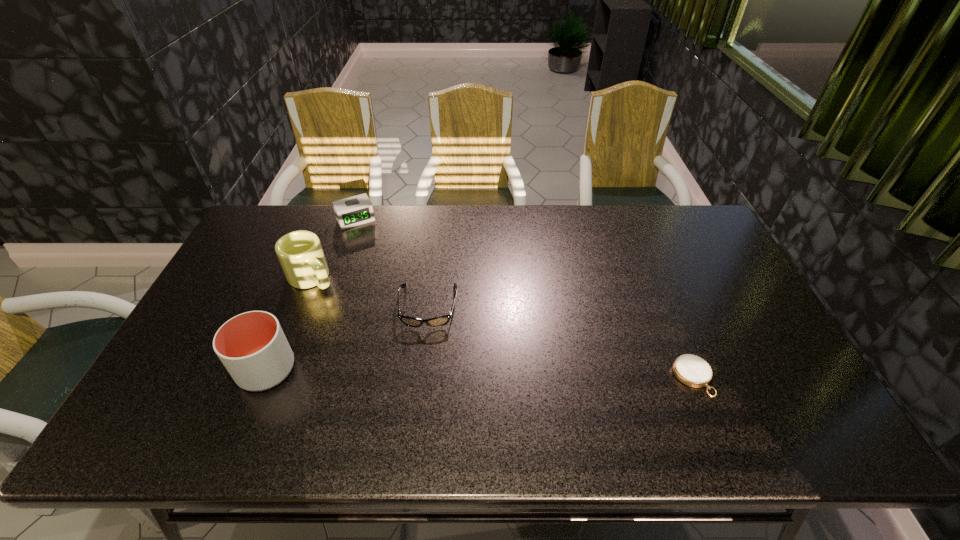
Identify the location of free location that satisfies the following two spatial constraints: 1. on the front side of the compass; 2. on the right side of the alarm clock. (303, 377).

Locate an element on the screen. The image size is (960, 540). vacant space that satisfies the following two spatial constraints: 1. on the front side of the second object from right to left; 2. on the left side of the compass is located at coordinates (420, 377).

I want to click on free point that satisfies the following two spatial constraints: 1. on the front side of the mug; 2. on the right side of the shortest object, so click(273, 377).